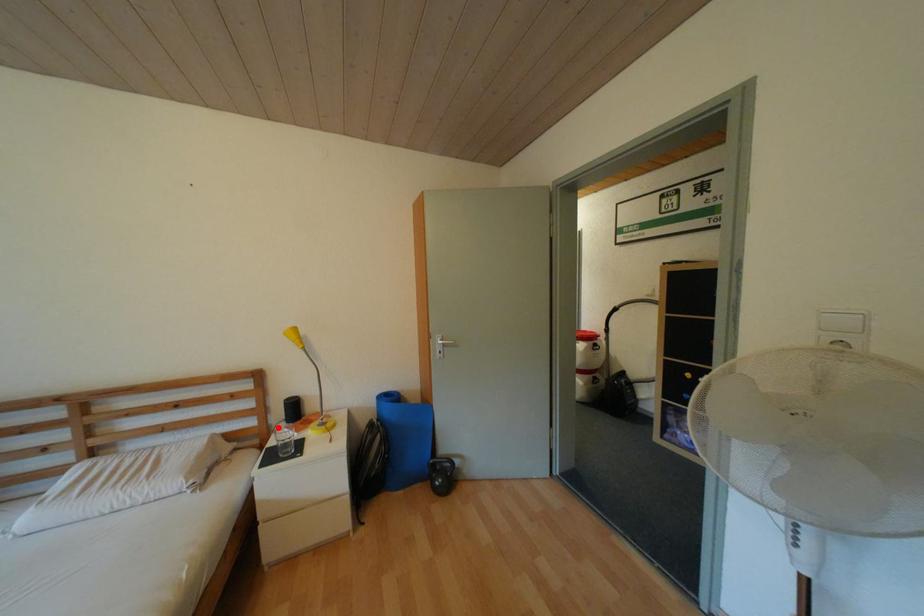
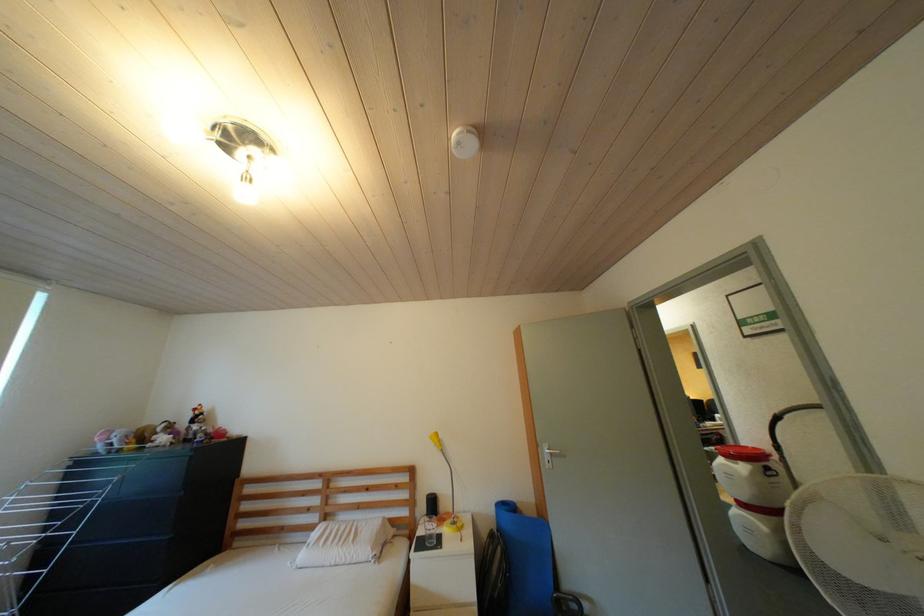
The point at the highlighted location is marked in the first image. Where is the corresponding point in the second image?

(424, 520)